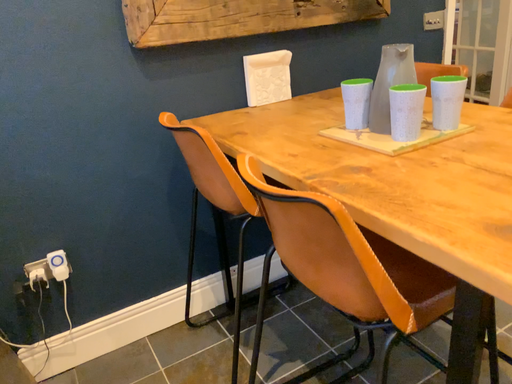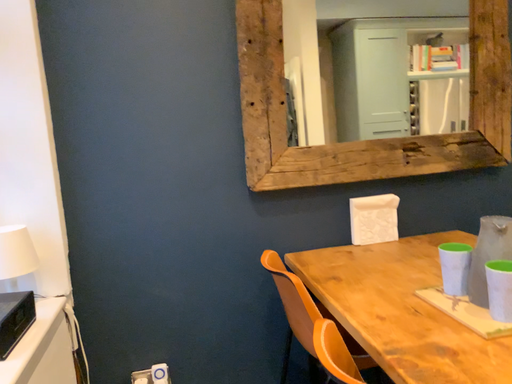
Question: Which way did the camera rotate in the video?

Choices:
 (A) rotated downward
 (B) rotated upward

Answer: (B)